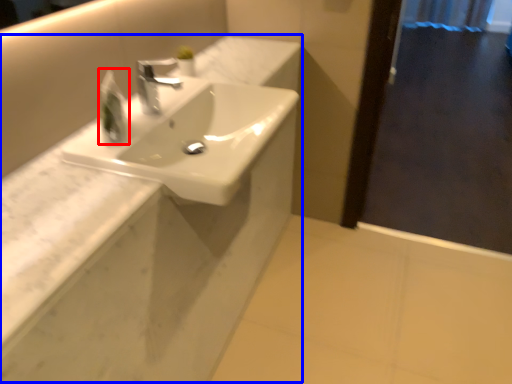
Question: Which object is further to the camera taking this photo, soap dispenser (highlighted by a red box) or counter (highlighted by a blue box)?

Choices:
 (A) soap dispenser
 (B) counter

Answer: (A)